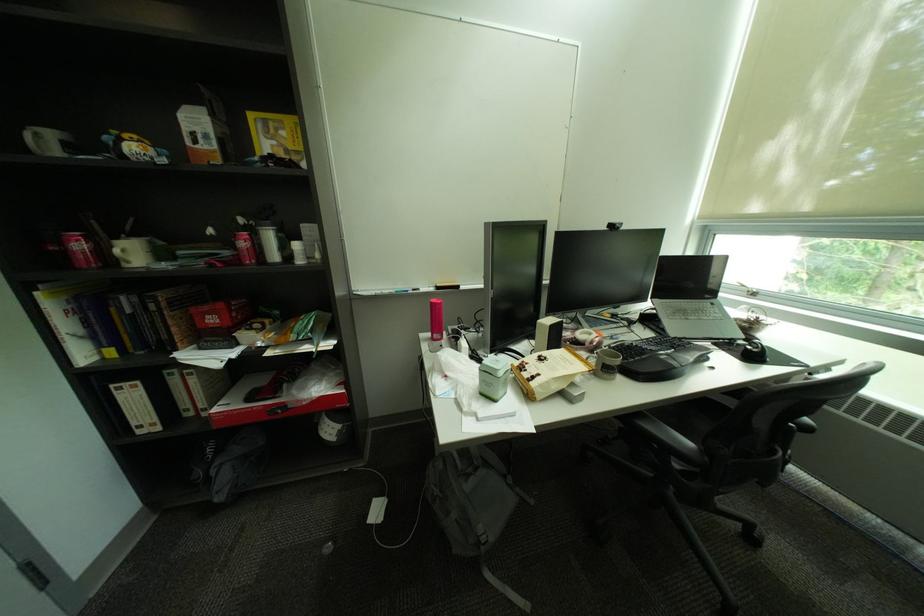
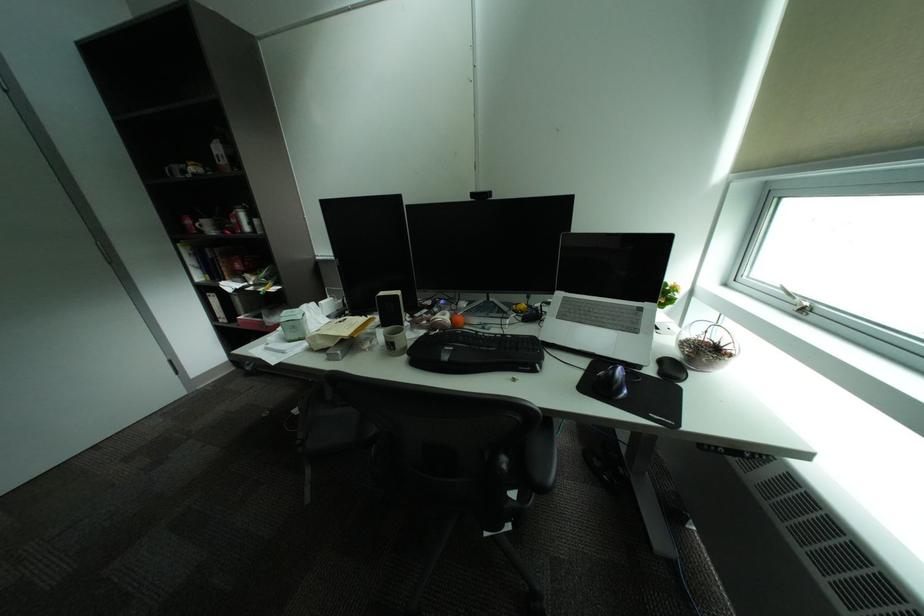
In the second image, find the point that corresponds to point (658, 341) in the first image.

(516, 336)